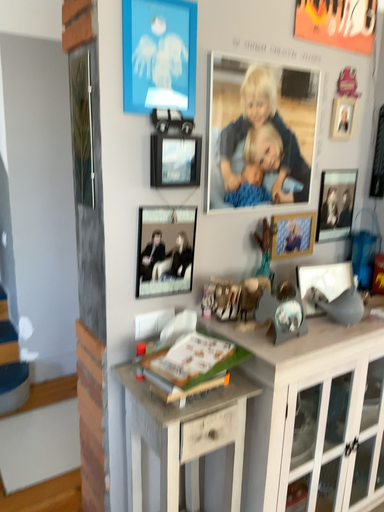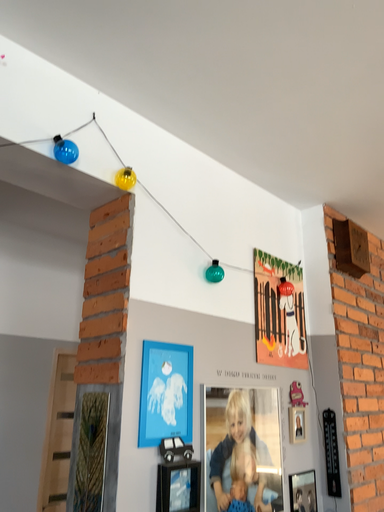
Question: How did the camera likely rotate when shooting the video?

Choices:
 (A) rotated right
 (B) rotated left

Answer: (A)